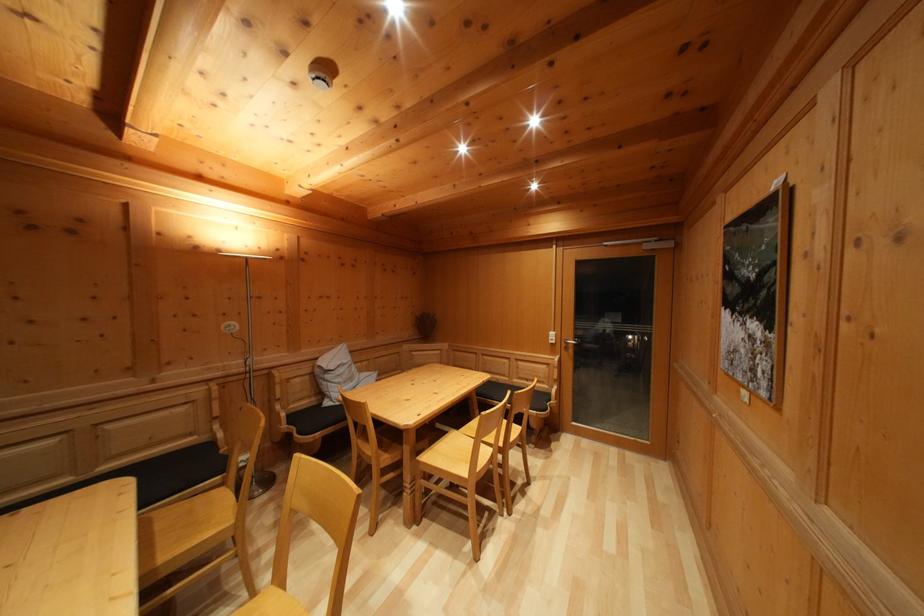
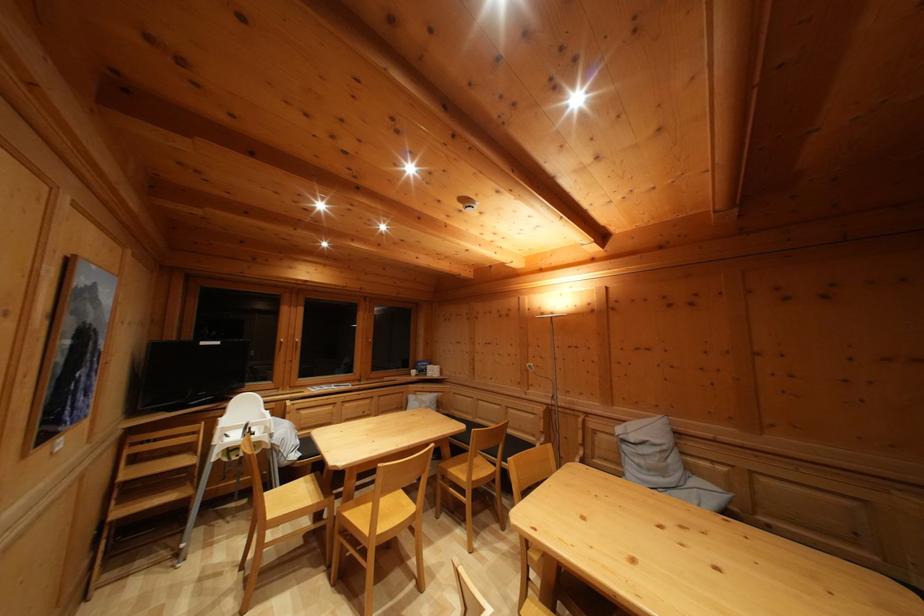
Find the pixel in the second image that matches [333,383] in the first image.

(629, 454)